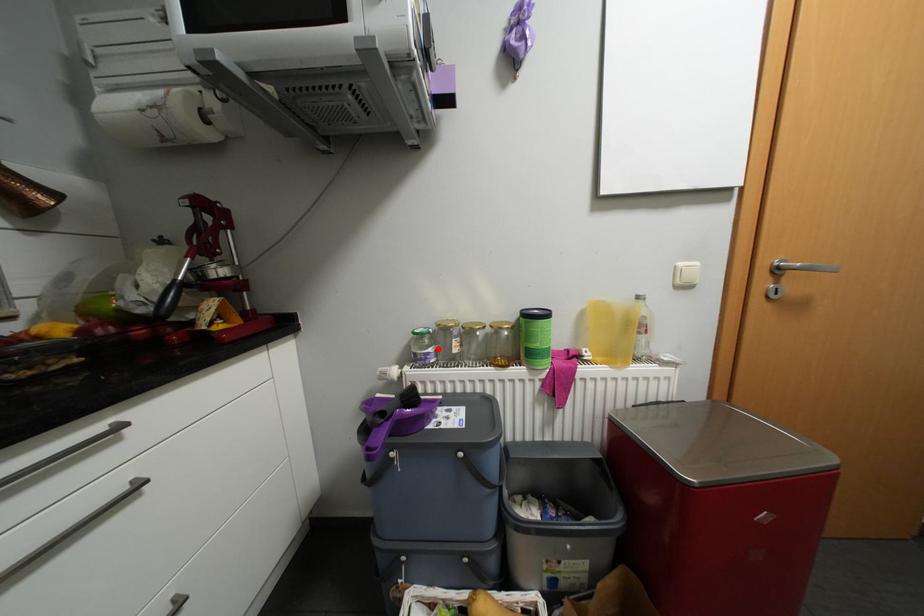
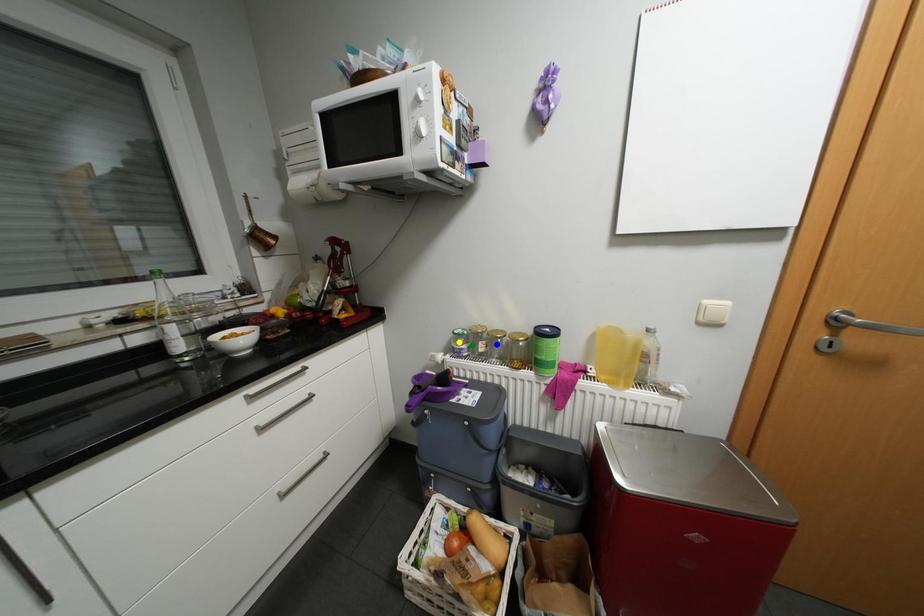
Question: I am providing you with two images of the same scene from different viewpoints. A red point is marked on the first image. You are given multiple points on the second image. Which point in image 2 represents the same 3d spot as the red point in image 1?

Choices:
 (A) green point
 (B) blue point
 (C) yellow point

Answer: (A)